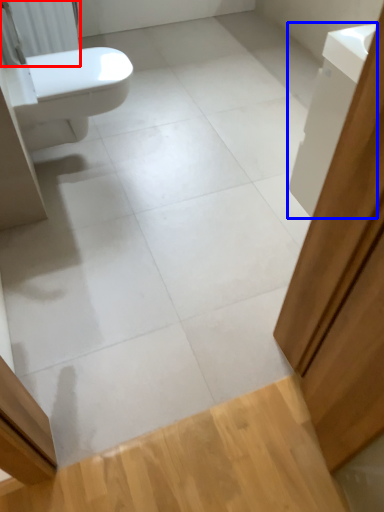
Question: Among these objects, which one is farthest to the camera, radiator (highlighted by a red box) or cabinetry (highlighted by a blue box)?

Choices:
 (A) radiator
 (B) cabinetry

Answer: (A)